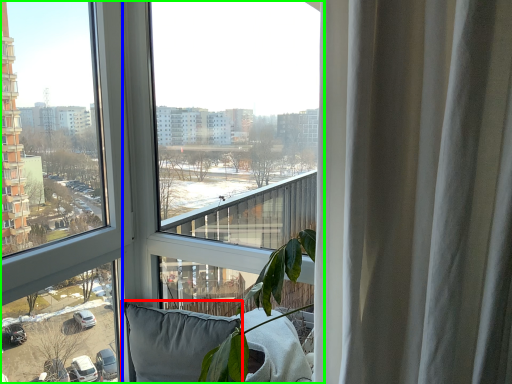
Question: Which object is positioned closest to pillow (highlighted by a red box)? Select from window (highlighted by a blue box) and window (highlighted by a green box).

Choices:
 (A) window
 (B) window

Answer: (A)